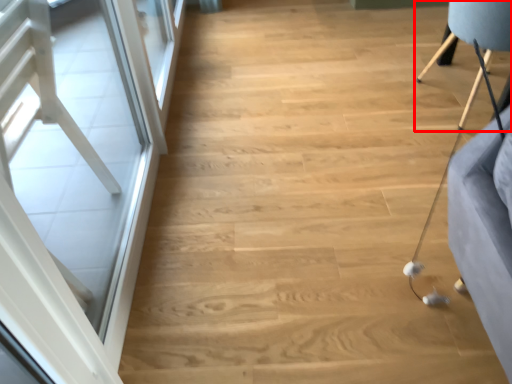
Question: Where is furniture (annotated by the red box) located in relation to screen door in the image?

Choices:
 (A) right
 (B) left

Answer: (A)